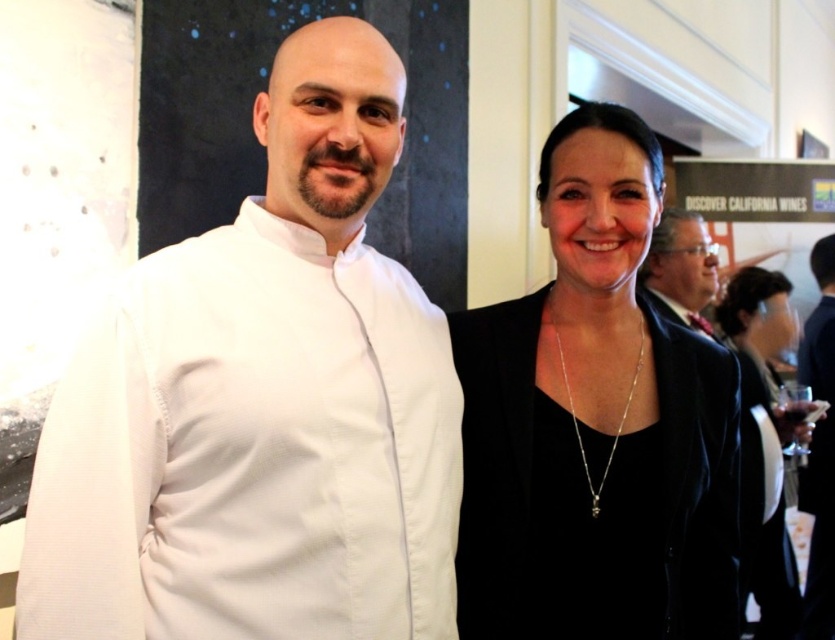
Consider the image. Is black matte blazer at upper right wider than black velvet dress at right?

No.

Between black matte blazer at upper right and black velvet dress at right, which one appears on the right side from the viewer's perspective?

From the viewer's perspective, black velvet dress at right appears more on the right side.

Measure the distance between point (676, 637) and camera.

A distance of 4.37 feet exists between point (676, 637) and camera.

Identify the location of black matte blazer at upper right. This screenshot has width=835, height=640. (595, 424).

Which of these two, white smooth chef coat at left or black velvet dress at right, stands taller?

With more height is black velvet dress at right.

Does white smooth chef coat at left come in front of black velvet dress at right?

Yes, it is in front of black velvet dress at right.

Locate an element on the screen. This screenshot has width=835, height=640. white smooth chef coat at left is located at coordinates (261, 404).

Does white smooth chef coat at left appear under black matte wine glass at right?

Incorrect, white smooth chef coat at left is not positioned below black matte wine glass at right.

Who is taller, white smooth chef coat at left or black matte wine glass at right?

With more height is black matte wine glass at right.

The image size is (835, 640). What are the coordinates of `white smooth chef coat at left` in the screenshot? It's located at (261, 404).

Where is `white smooth chef coat at left`? white smooth chef coat at left is located at coordinates (261, 404).